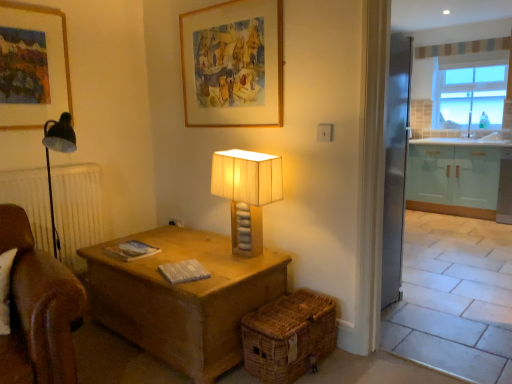
Question: Which direction should I rotate to look at wooden picture frame at upper center, the first picture frame viewed from the right?

Choices:
 (A) left
 (B) right

Answer: (A)

Question: Considering the relative sizes of woven brown basket at lower center and white glossy sink at right in the image provided, is woven brown basket at lower center taller than white glossy sink at right?

Choices:
 (A) yes
 (B) no

Answer: (A)

Question: Could white glossy sink at right be considered to be inside woven brown basket at lower center?

Choices:
 (A) yes
 (B) no

Answer: (B)

Question: Can you confirm if woven brown basket at lower center is shorter than white glossy sink at right?

Choices:
 (A) no
 (B) yes

Answer: (A)

Question: Can you confirm if woven brown basket at lower center is bigger than white glossy sink at right?

Choices:
 (A) yes
 (B) no

Answer: (A)

Question: Is woven brown basket at lower center positioned far away from white glossy sink at right?

Choices:
 (A) no
 (B) yes

Answer: (B)

Question: Are woven brown basket at lower center and white glossy sink at right beside each other?

Choices:
 (A) no
 (B) yes

Answer: (A)

Question: Is wooden picture frame at upper left, the 2th picture frame from the right, wider than wooden picture frame at upper center, the first picture frame viewed from the right?

Choices:
 (A) yes
 (B) no

Answer: (A)

Question: Are wooden picture frame at upper left, the 2th picture frame from the right, and wooden picture frame at upper center, the first picture frame viewed from the right, far apart?

Choices:
 (A) no
 (B) yes

Answer: (B)

Question: Is wooden picture frame at upper left, the 2th picture frame from the right, bigger than wooden picture frame at upper center, the first picture frame viewed from the right?

Choices:
 (A) yes
 (B) no

Answer: (A)

Question: Considering the relative sizes of wooden picture frame at upper left, the 1th picture frame viewed from the left, and wooden picture frame at upper center, the second picture frame viewed from the left, in the image provided, is wooden picture frame at upper left, the 1th picture frame viewed from the left, taller than wooden picture frame at upper center, the second picture frame viewed from the left,?

Choices:
 (A) no
 (B) yes

Answer: (A)

Question: From the image's perspective, is wooden picture frame at upper left, the 2th picture frame from the right, on top of wooden picture frame at upper center, the second picture frame viewed from the left?

Choices:
 (A) no
 (B) yes

Answer: (A)

Question: Is wooden picture frame at upper left, the 1th picture frame viewed from the left, not within wooden picture frame at upper center, the first picture frame viewed from the right?

Choices:
 (A) yes
 (B) no

Answer: (A)

Question: Does white glossy sink at right appear on the left side of clear glass window at upper right?

Choices:
 (A) yes
 (B) no

Answer: (A)